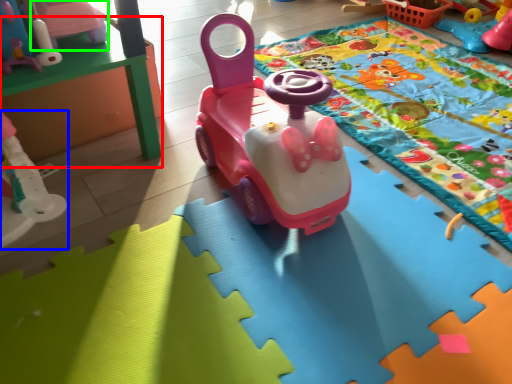
Question: Which object is positioned farthest from table (highlighted by a red box)? Select from toy (highlighted by a blue box) and toy (highlighted by a green box).

Choices:
 (A) toy
 (B) toy

Answer: (A)